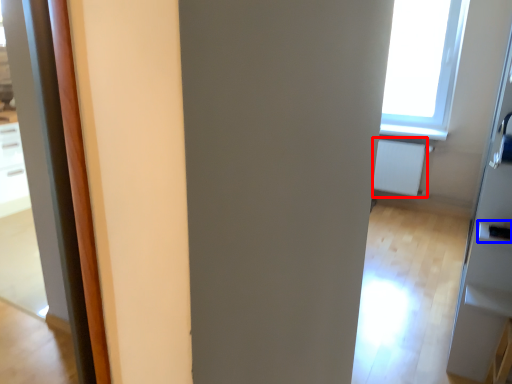
Question: Which point is further to the camera, radiator (highlighted by a red box) or door handle (highlighted by a blue box)?

Choices:
 (A) radiator
 (B) door handle

Answer: (A)